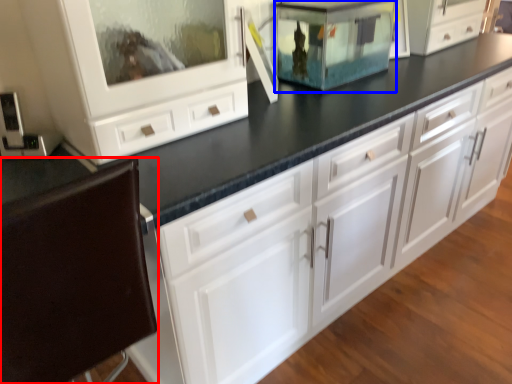
Question: Which object is further to the camera taking this photo, cabinetry (highlighted by a red box) or appliance (highlighted by a blue box)?

Choices:
 (A) cabinetry
 (B) appliance

Answer: (B)